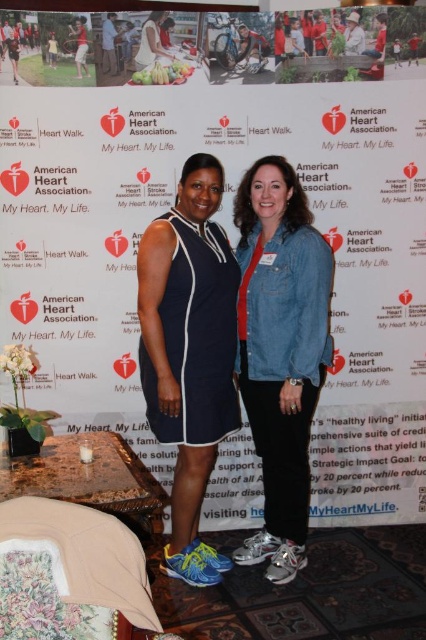
You are a photographer setting up for a group photo at the American Heart Association Heart Walk event. You notice a white paper at center and a denim jacket at center in the frame. Which object is taller in the scene?

The white paper at center is taller than the denim jacket at center according to the description.

You are organizing a charity event and need to decide which clothing item to feature in the promotional material. The denim jacket at center and the navy blue jersey dress at center are both options. Based on their sizes, which one would you choose to ensure it stands out more in the photo?

The denim jacket at center is bigger than the navy blue jersey dress at center, so choosing the denim jacket at center would make it stand out more in the promotional material due to its larger size.